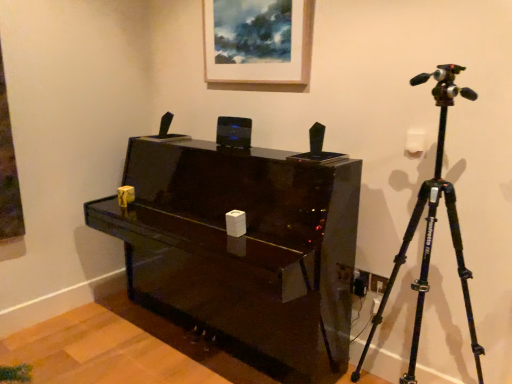
Question: From a real-world perspective, is black matte tripod at right above or below wooden picture frame at upper center?

Choices:
 (A) below
 (B) above

Answer: (A)

Question: In terms of height, does black matte tripod at right look taller or shorter compared to wooden picture frame at upper center?

Choices:
 (A) tall
 (B) short

Answer: (A)

Question: Based on their relative distances, which object is nearer to the black matte tripod at right?

Choices:
 (A) wooden picture frame at upper center
 (B) glossy black piano at center

Answer: (B)

Question: Estimate the real-world distances between objects in this image. Which object is closer to the glossy black piano at center?

Choices:
 (A) black matte tripod at right
 (B) wooden picture frame at upper center

Answer: (A)